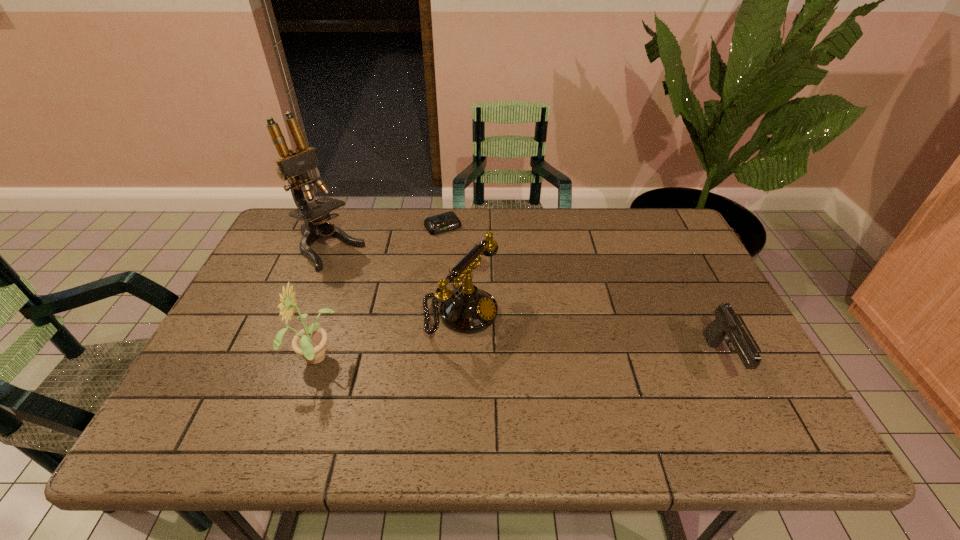
The height and width of the screenshot is (540, 960). In the image, there is a desktop. Find the location of `vacant space at the far right corner`. vacant space at the far right corner is located at coordinates (676, 246).

Locate an element on the screen. The width and height of the screenshot is (960, 540). free point between the sunflower and the telephone is located at coordinates (389, 338).

Find the location of `empty location between the telephone and the rightmost object`. empty location between the telephone and the rightmost object is located at coordinates (591, 338).

Locate an element on the screen. This screenshot has height=540, width=960. empty space between the sunflower and the telephone is located at coordinates (389, 338).

This screenshot has width=960, height=540. In order to click on vacant space in between the fourth tallest object and the tallest object in this screenshot , I will do `click(525, 305)`.

This screenshot has width=960, height=540. I want to click on vacant region between the shortest object and the pistol, so tap(582, 294).

Identify the location of vacant space that is in between the rightmost object and the third tallest object. This screenshot has height=540, width=960. point(591,338).

At what (x,y) coordinates should I click in order to perform the action: click on free area in between the microscope and the telephone. Please return your answer as a coordinate pair (x, y). Image resolution: width=960 pixels, height=540 pixels. Looking at the image, I should click on (395, 282).

The width and height of the screenshot is (960, 540). What are the coordinates of `free area in between the rightmost object and the tallest object` in the screenshot? It's located at (525, 305).

Find the location of a particular element. The image size is (960, 540). free space between the microscope and the third shortest object is located at coordinates (395, 282).